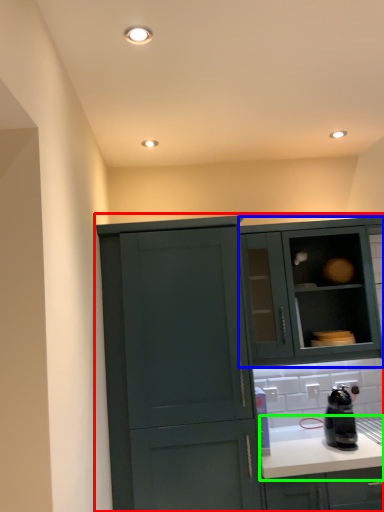
Question: Estimate the real-world distances between objects in this image. Which object is closer to cabinetry (highlighted by a red box), cabinetry (highlighted by a blue box) or countertop (highlighted by a green box)?

Choices:
 (A) cabinetry
 (B) countertop

Answer: (B)